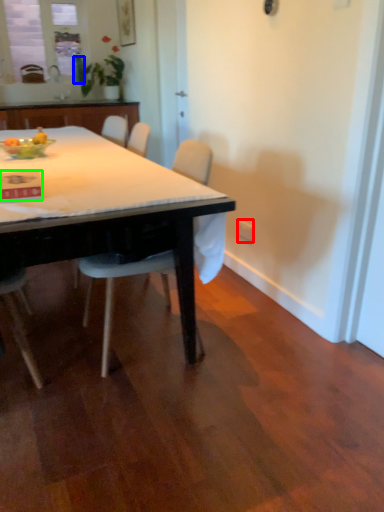
Question: Estimate the real-world distances between objects in this image. Which object is farther from power outlet (highlighted by a red box), bottle (highlighted by a blue box) or kitchen & dining room table (highlighted by a green box)?

Choices:
 (A) bottle
 (B) kitchen & dining room table

Answer: (A)